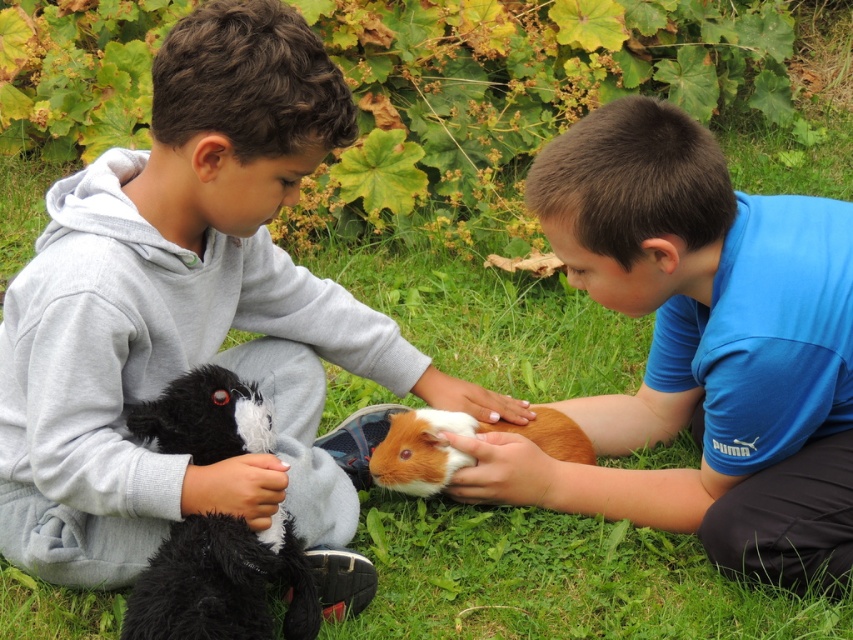
Can you confirm if blue cotton shirt at center is positioned to the left of black plush toy at left?

Incorrect, blue cotton shirt at center is not on the left side of black plush toy at left.

Image resolution: width=853 pixels, height=640 pixels. Describe the element at coordinates (699, 348) in the screenshot. I see `blue cotton shirt at center` at that location.

Find the location of `blue cotton shirt at center`. blue cotton shirt at center is located at coordinates (699, 348).

Between blue cotton shirt at center and fluffy brown guinea pig at center, which one has more height?

With more height is blue cotton shirt at center.

Can you confirm if blue cotton shirt at center is positioned to the right of fluffy brown guinea pig at center?

Yes, blue cotton shirt at center is to the right of fluffy brown guinea pig at center.

Is point (825, 244) in front of point (427, 424)?

Yes, point (825, 244) is closer to viewer.

Image resolution: width=853 pixels, height=640 pixels. I want to click on blue cotton shirt at center, so click(x=699, y=348).

Who is positioned more to the right, soft gray hoodie at center or black plush toy at left?

From the viewer's perspective, soft gray hoodie at center appears more on the right side.

Can you confirm if soft gray hoodie at center is positioned to the left of black plush toy at left?

Incorrect, soft gray hoodie at center is not on the left side of black plush toy at left.

This screenshot has height=640, width=853. Describe the element at coordinates (194, 317) in the screenshot. I see `soft gray hoodie at center` at that location.

This screenshot has width=853, height=640. I want to click on soft gray hoodie at center, so click(x=194, y=317).